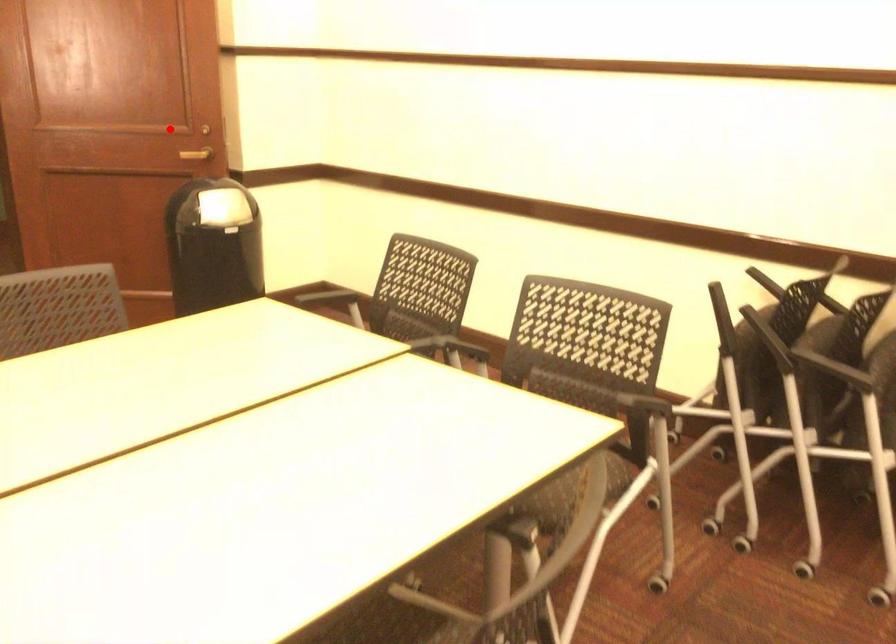
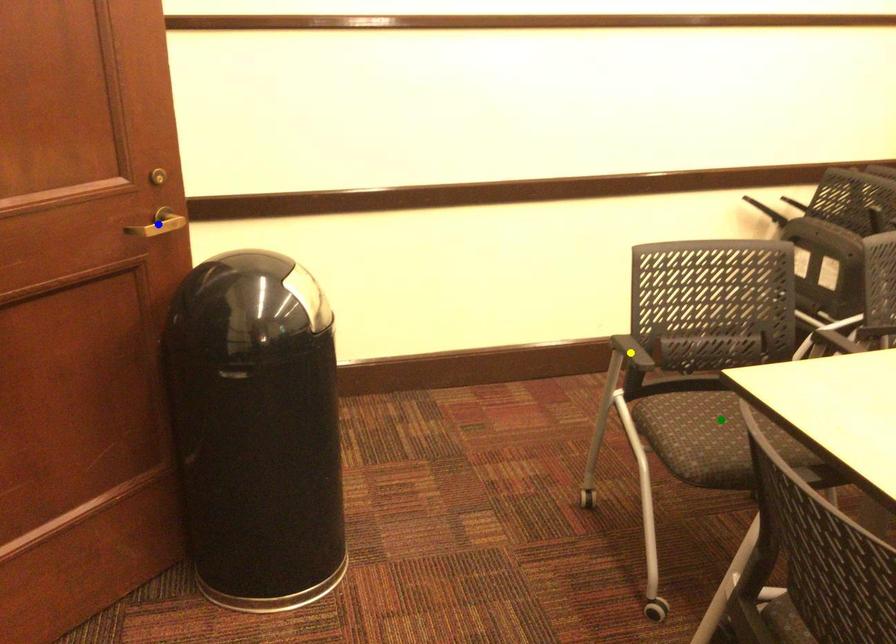
Question: I am providing you with two images of the same scene from different viewpoints. A red point is marked on the first image. You are given multiple points on the second image. Which spot in image 2 lines up with the point in image 1?

Choices:
 (A) green point
 (B) yellow point
 (C) blue point

Answer: (C)